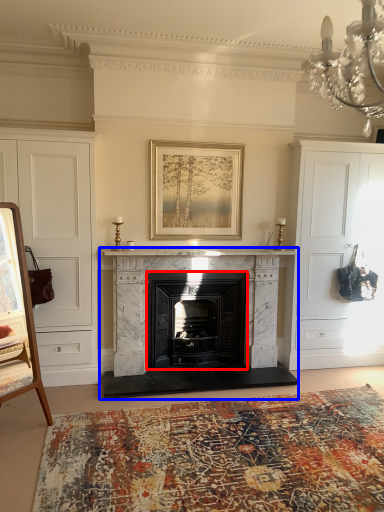
Question: Which point is further to the camera, fireplace (highlighted by a red box) or fireplace (highlighted by a blue box)?

Choices:
 (A) fireplace
 (B) fireplace

Answer: (A)